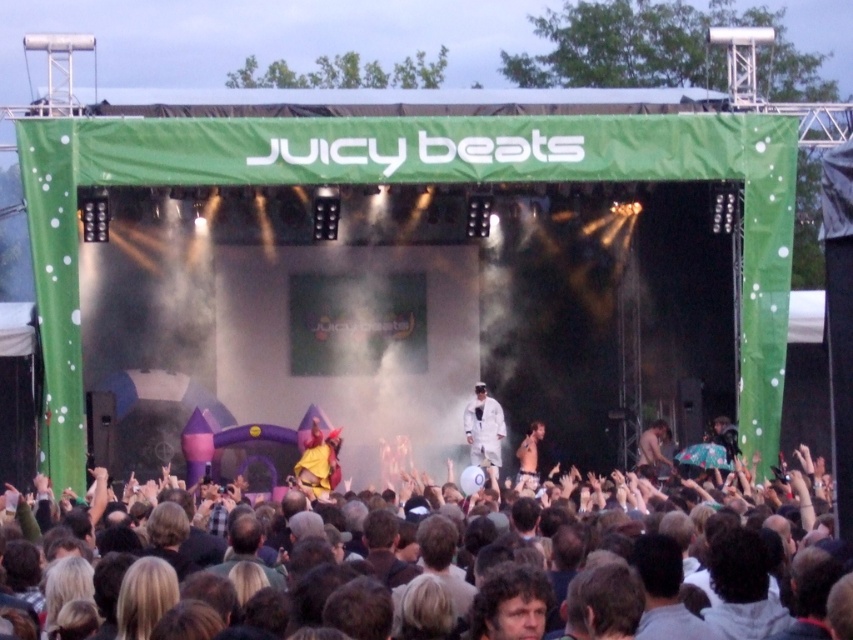
You are a photographer at the concert and want to capture a photo where the white matte suit at center and the yellow fabric at center are both visible. Given their heights, which one will appear taller in the photo?

The white matte suit at center appears taller in the photo because it has a greater height compared to the yellow fabric at center.

You are a photographer positioned at the front of the crowd at the JUICY BEATS concert. You want to capture a photo of the performer in the white matte suit at center. Based on the coordinates provided, where should you aim your camera to ensure the performer is centered in the frame?

The white matte suit at center is located at coordinates point [485,432], so aim your camera towards that point to center the performer in the frame.

Looking at this image, you are a photographer at the concert trying to capture a photo of the dark brown hair at center and the dark brown leather jacket at lower right. Based on their positions, which object is closer to the camera?

The dark brown hair at center is closer to the camera because it is positioned below the dark brown leather jacket at lower right, indicating it is in front of it.